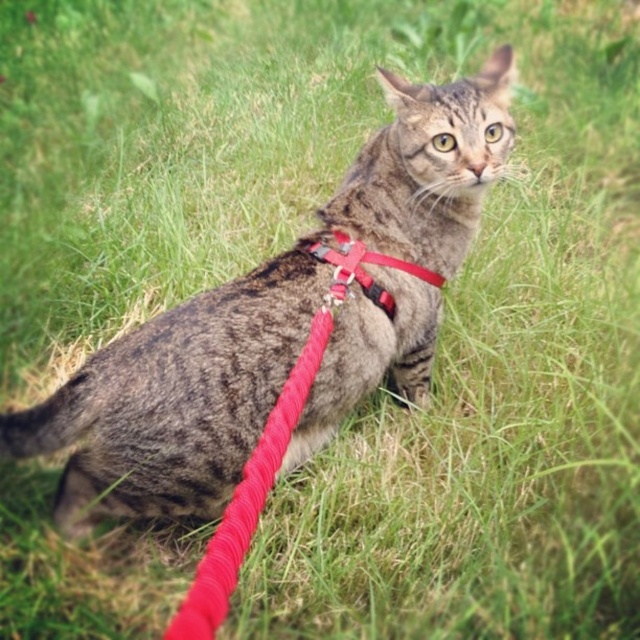
You are a dog walking past the tabby fur cat at center and the matte red harness at center in a park. The leash you are holding is 10 inches long. Can you safely approach the cat without getting tangled in its harness?

The tabby fur cat at center and the matte red harness at center are 10.24 inches apart from each other. Since your leash is 10 inches long, you cannot safely approach without risking tangling because the distance between them is slightly longer than your leash.

You are a photographer trying to capture the tabby fur cat at center. The camera you are using has a focus point at coordinate point (262, 317). Will this focus point be effective for capturing the cat?

The point (262, 317) indicates the location of the tabby fur cat at center, so yes, this focus point will effectively capture the cat as it is centered on the cat.

You are a dog walking past the tabby fur cat at center and the matte red harness at center. Which object is positioned more to the left?

The tabby fur cat at center is positioned more to the left than the matte red harness at center.